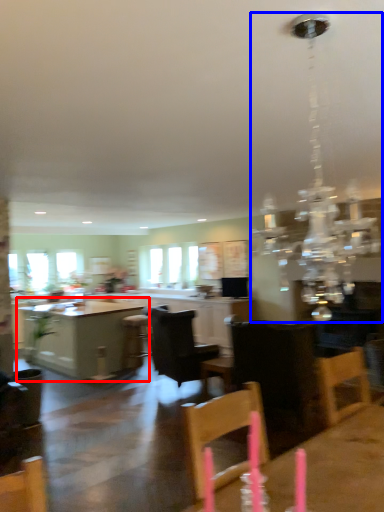
Question: Among these objects, which one is farthest to the camera, table (highlighted by a red box) or light fixture (highlighted by a blue box)?

Choices:
 (A) table
 (B) light fixture

Answer: (A)